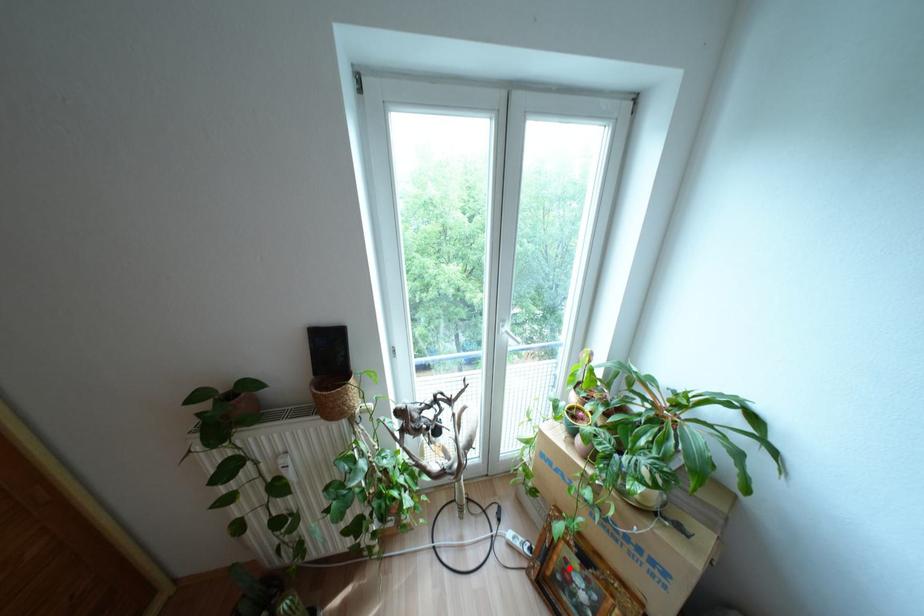
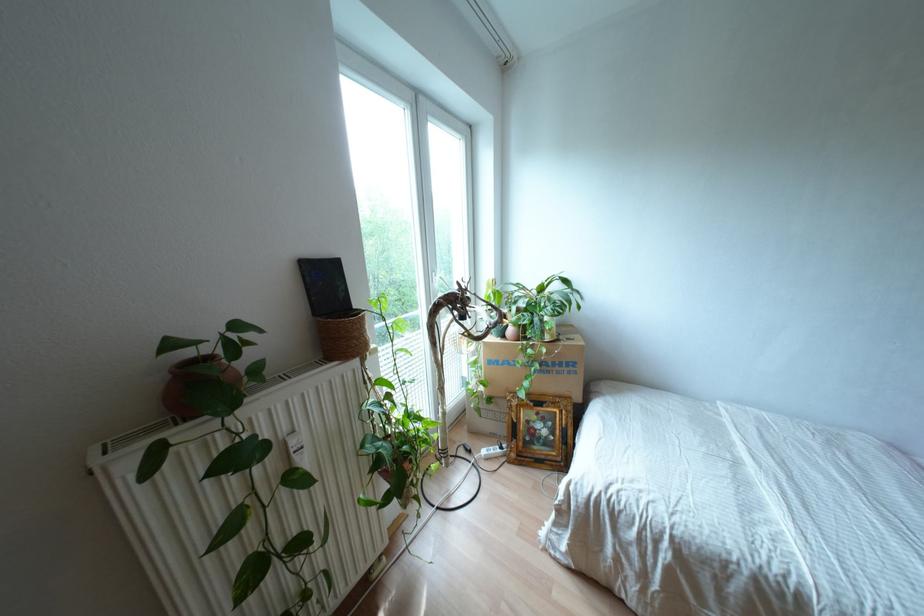
Question: I am providing you with two images of the same scene from different viewpoints. A red point is shown in image1. For the corresponding object point in image2, is it positioned nearer or farther from the camera?

Choices:
 (A) Nearer
 (B) Farther

Answer: (B)